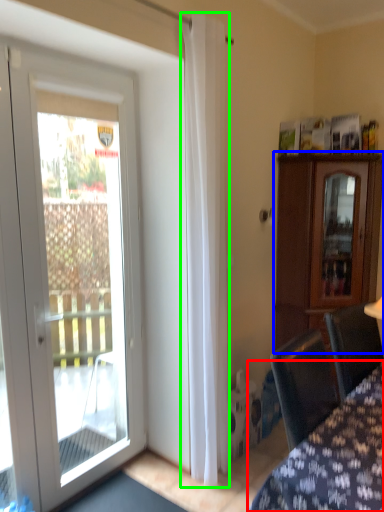
Question: Which object is positioned closest to furniture (highlighted by a red box)? Select from cabinetry (highlighted by a blue box) and curtain (highlighted by a green box).

Choices:
 (A) cabinetry
 (B) curtain

Answer: (B)